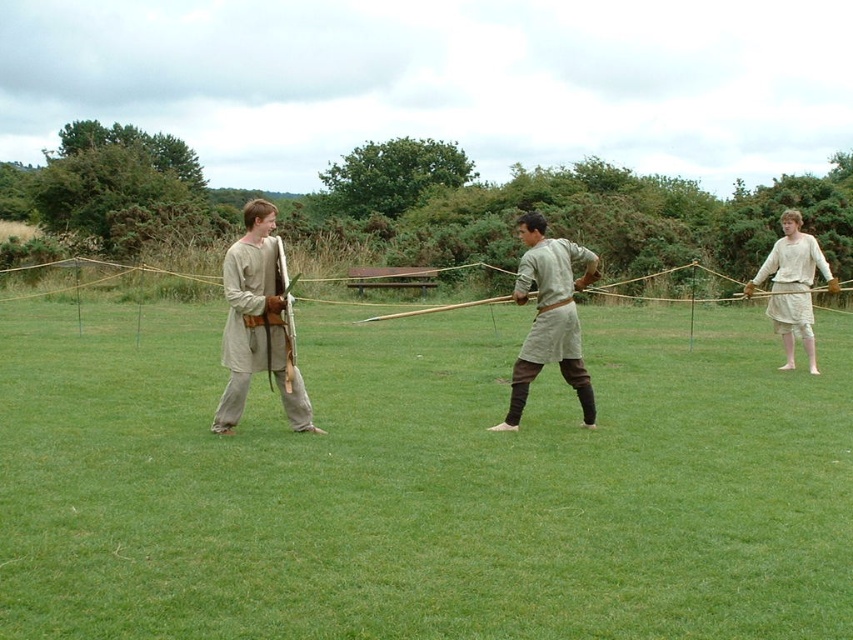
You are a knight standing on the green grass at center and looking towards the light beige linen shirt at right. Which object is taller from your perspective?

The light beige linen shirt at right is taller than the green grass at center from your perspective.

You are an observer standing in front of the three individuals on the grassy field. You notice the light beige fabric shirt at center and the brown rope at center. Which object is shorter in height?

The light beige fabric shirt at center is shorter in height than the brown rope at center.